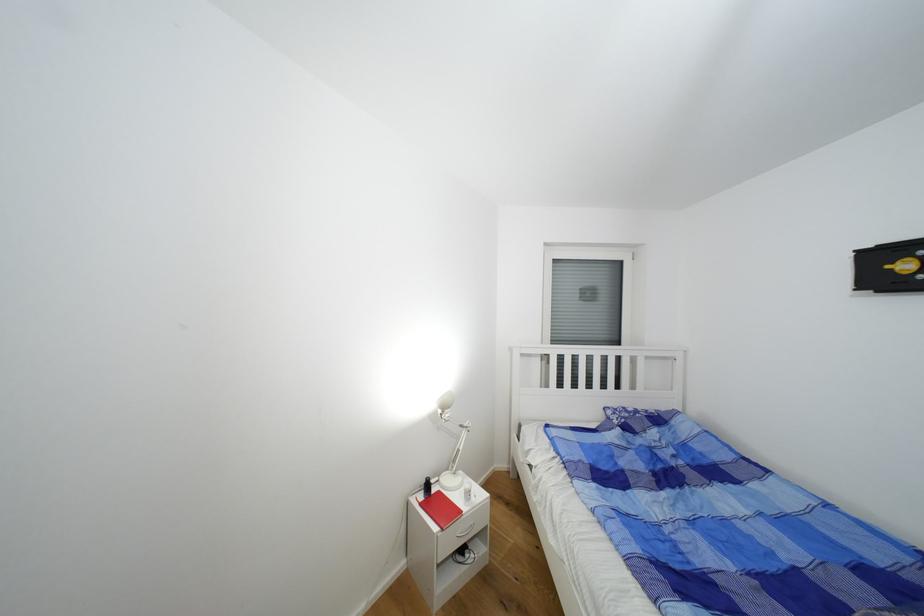
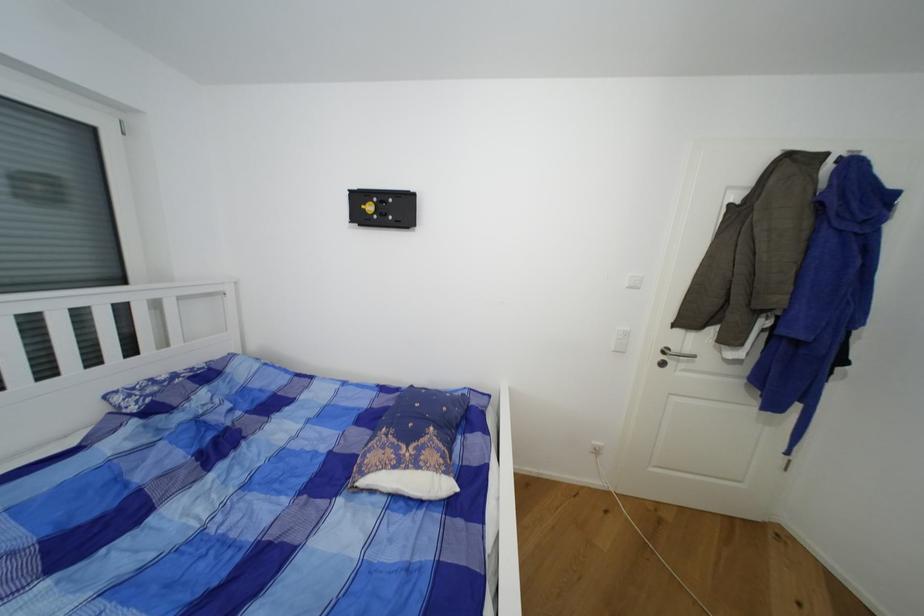
Find the pixel in the second image that matches point 894,268 in the first image.

(369, 208)